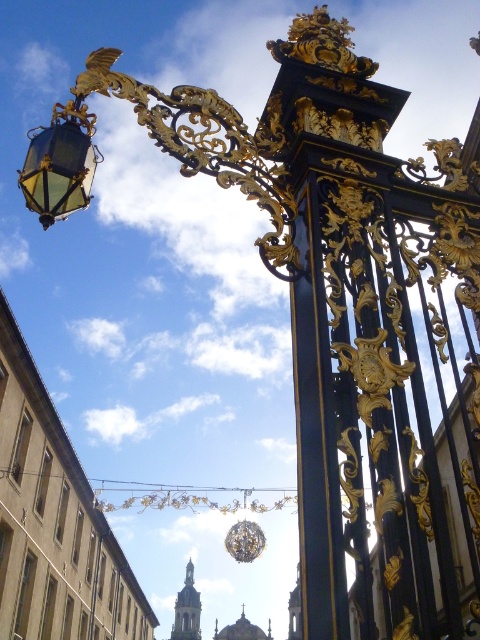
Can you confirm if black polished metal gate at center is bigger than gold textured lamp at center?

No, black polished metal gate at center is not bigger than gold textured lamp at center.

Is black polished metal gate at center behind gold textured lamp at center?

No, it is not.

Which is in front, point (320, 273) or point (245, 541)?

Point (320, 273)

The height and width of the screenshot is (640, 480). In order to click on black polished metal gate at center in this screenshot , I will do `click(316, 435)`.

Can you confirm if beige stone building at lower left is smaller than black polished metal gate at center?

Incorrect, beige stone building at lower left is not smaller in size than black polished metal gate at center.

Between beige stone building at lower left and black polished metal gate at center, which one appears on the left side from the viewer's perspective?

beige stone building at lower left

Is point (17, 420) closer to camera compared to point (313, 358)?

No, it is not.

This screenshot has width=480, height=640. I want to click on beige stone building at lower left, so click(x=54, y=522).

The height and width of the screenshot is (640, 480). What do you see at coordinates (60, 163) in the screenshot?
I see `matte gold lantern at upper left` at bounding box center [60, 163].

Is point (84, 192) closer to camera compared to point (251, 538)?

Yes.

Locate an element on the screen. Image resolution: width=480 pixels, height=640 pixels. matte gold lantern at upper left is located at coordinates (60, 163).